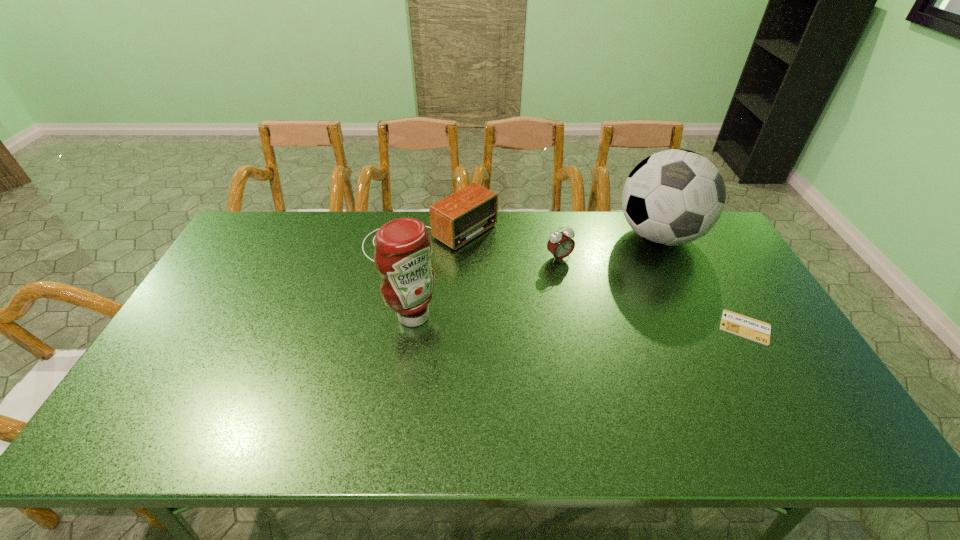
The height and width of the screenshot is (540, 960). What are the coordinates of `vacant space located 0.300m on the main logo of the soccer ball` in the screenshot? It's located at click(x=615, y=320).

This screenshot has height=540, width=960. What are the coordinates of `free space located 0.200m on the main logo of the soccer ball` in the screenshot? It's located at (x=627, y=299).

Where is `vacant space located on the main logo of the soccer ball`? vacant space located on the main logo of the soccer ball is located at coordinates (641, 272).

You are a GUI agent. You are given a task and a screenshot of the screen. Output one action in this format:
    pyautogui.click(x=<x>, y=<y>)
    Task: Click on the blank space located on the clock face of the third object from right to left
    Image resolution: width=960 pixels, height=540 pixels.
    Given the screenshot: What is the action you would take?
    pos(582,282)

Find the location of a particular element. The image size is (960, 540). vacant space situated 0.300m on the clock face of the third object from right to left is located at coordinates (623, 330).

Find the location of a particular element. The width and height of the screenshot is (960, 540). free space located 0.080m on the clock face of the third object from right to left is located at coordinates (580, 280).

This screenshot has height=540, width=960. I want to click on radio receiver located at the far edge, so click(x=455, y=220).

At what (x,y) coordinates should I click in order to perform the action: click on soccer ball situated at the far edge. Please return your answer as a coordinate pair (x, y). Looking at the image, I should click on (673, 197).

Where is `alarm clock that is at the far edge`? alarm clock that is at the far edge is located at coordinates (560, 244).

Locate an element on the screen. The height and width of the screenshot is (540, 960). identity card positioned at the right edge is located at coordinates (732, 322).